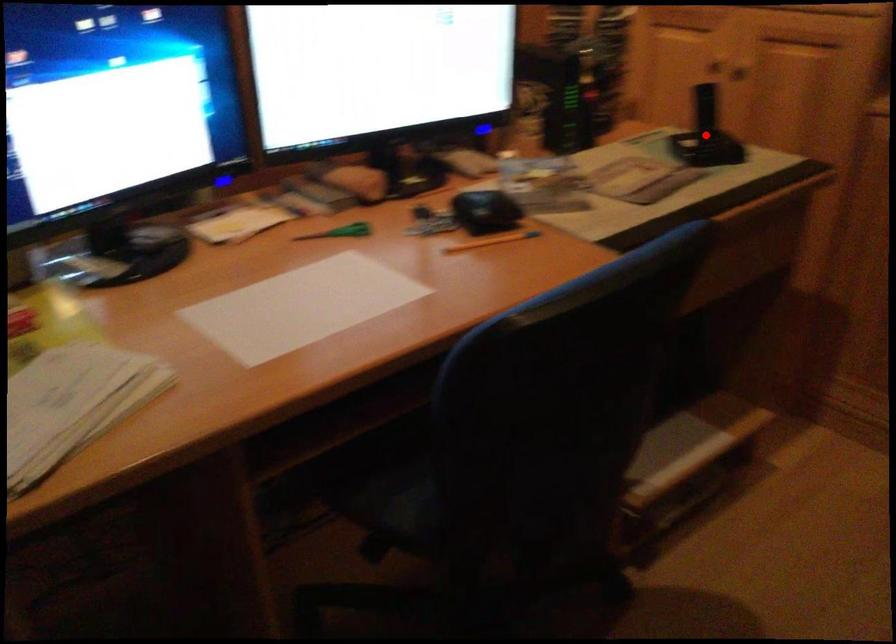
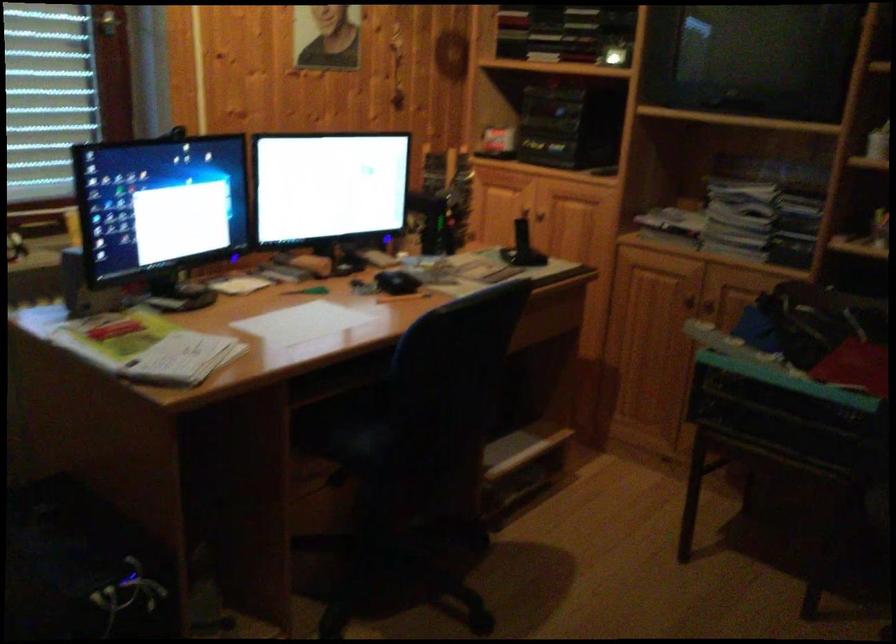
Question: I am providing you with two images of the same scene from different viewpoints. A red point is marked on the first image. Is the red point's position out of view in image 2?

Choices:
 (A) Yes
 (B) No

Answer: (A)